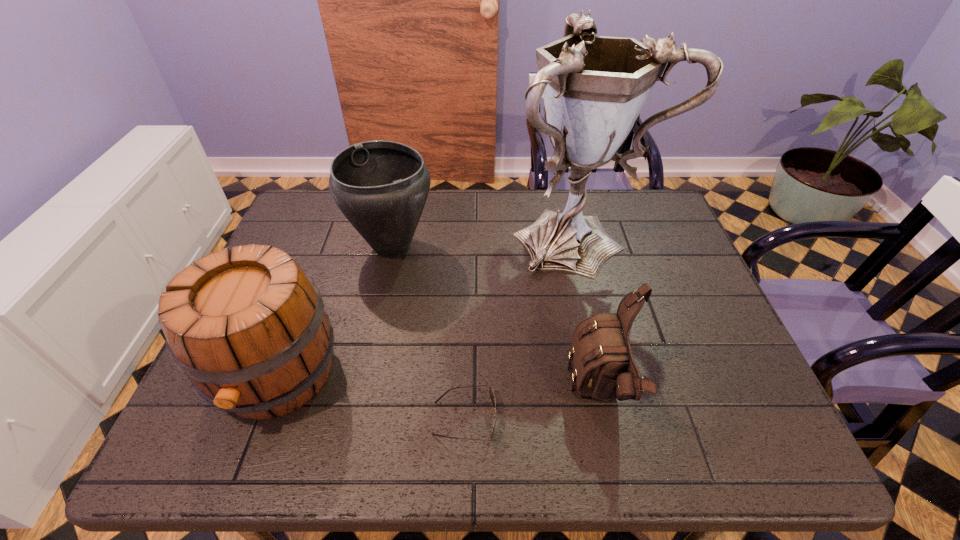
Find the location of a particular element. object that is at the far right corner is located at coordinates (594, 87).

This screenshot has height=540, width=960. In order to click on free space at the far edge in this screenshot , I will do `click(507, 193)`.

You are a GUI agent. You are given a task and a screenshot of the screen. Output one action in this format:
    pyautogui.click(x=<x>, y=<y>)
    Task: Click on the free space at the right edge of the desktop
    The height and width of the screenshot is (540, 960).
    Given the screenshot: What is the action you would take?
    pyautogui.click(x=639, y=244)

This screenshot has width=960, height=540. In the image, there is a desktop. In order to click on vacant area at the far right corner in this screenshot , I will do `click(619, 193)`.

In order to click on free region at the near right corner in this screenshot , I will do `click(710, 430)`.

The image size is (960, 540). Identify the location of vacant area between the cider and the sunglasses. (371, 396).

The width and height of the screenshot is (960, 540). Identify the location of free space between the sunglasses and the trophy cup. (521, 327).

Image resolution: width=960 pixels, height=540 pixels. I want to click on free space between the urn and the trophy cup, so click(485, 241).

Where is `vacant area that lies between the cider and the third object from left to right`? This screenshot has width=960, height=540. vacant area that lies between the cider and the third object from left to right is located at coordinates (371, 396).

Find the location of `vacant area between the trophy cup and the shortest object`. vacant area between the trophy cup and the shortest object is located at coordinates point(521,327).